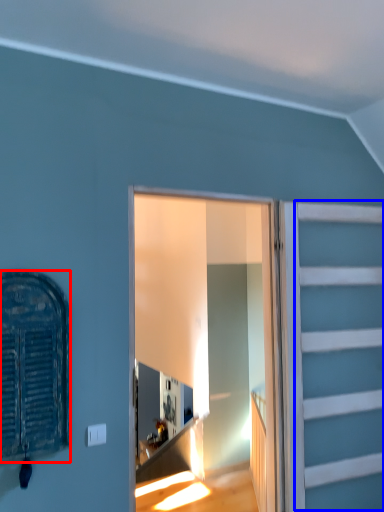
Question: Among these objects, which one is farthest to the camera, window (highlighted by a red box) or garage door (highlighted by a blue box)?

Choices:
 (A) window
 (B) garage door

Answer: (B)